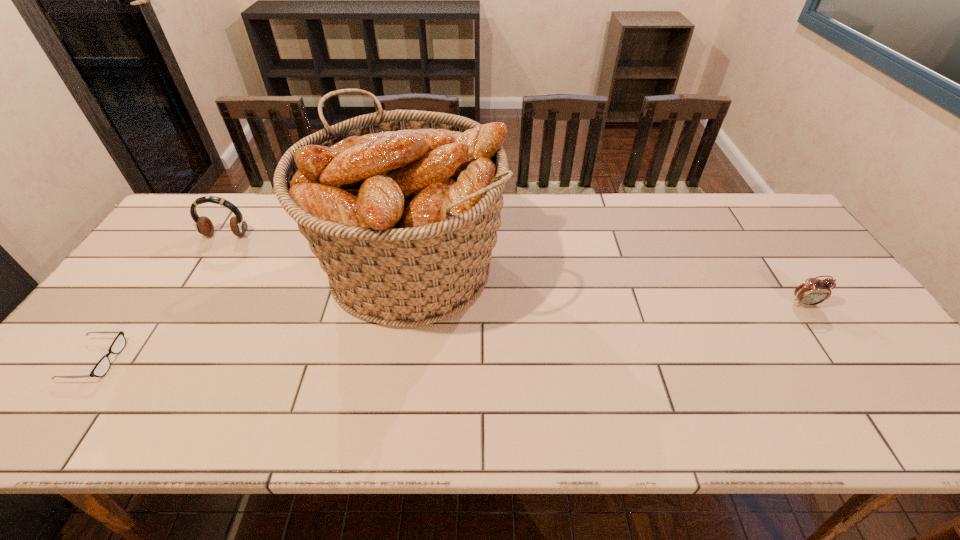
Locate an element on the screen. This screenshot has width=960, height=540. basket located at the far edge is located at coordinates (402, 207).

What are the coordinates of `headset that is at the far edge` in the screenshot? It's located at click(x=203, y=225).

Where is `headset that is at the left edge`? This screenshot has height=540, width=960. headset that is at the left edge is located at coordinates (203, 225).

This screenshot has height=540, width=960. What are the coordinates of `spectacles that is positioned at the left edge` in the screenshot? It's located at (101, 368).

Find the location of `object situated at the right edge`. object situated at the right edge is located at coordinates (813, 291).

This screenshot has width=960, height=540. I want to click on object present at the far left corner, so click(x=203, y=225).

Where is `vacant space at the far edge`? vacant space at the far edge is located at coordinates (657, 193).

At what (x,y) coordinates should I click in order to perform the action: click on free space at the near edge of the desktop. Please return your answer as a coordinate pair (x, y). Looking at the image, I should click on (596, 407).

Locate an element on the screen. Image resolution: width=960 pixels, height=540 pixels. free spot at the left edge of the desktop is located at coordinates (111, 373).

You are a GUI agent. You are given a task and a screenshot of the screen. Output one action in this format:
    pyautogui.click(x=<x>, y=<y>)
    Task: Click on the free space at the right edge of the desktop
    This screenshot has height=540, width=960.
    Given the screenshot: What is the action you would take?
    pyautogui.click(x=802, y=252)